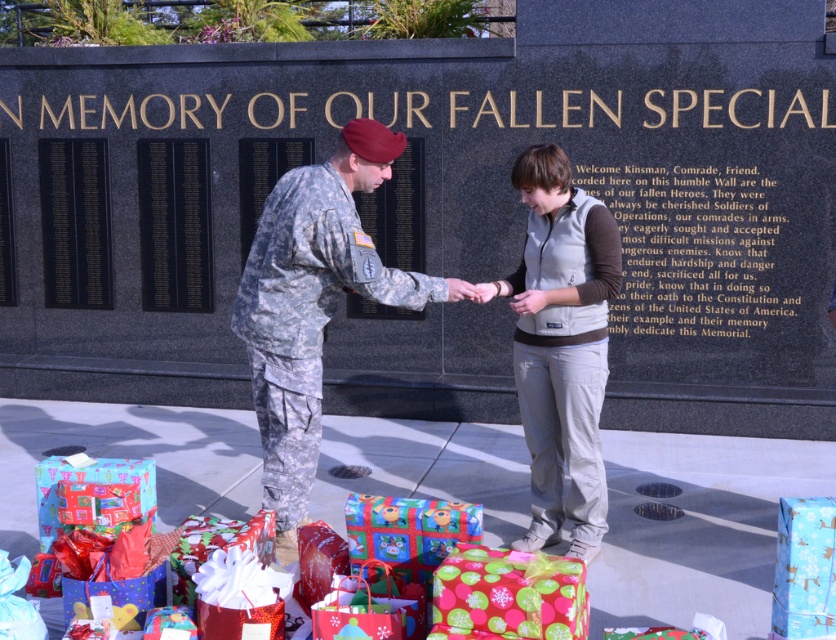
You are a photographer trying to capture a photo of the memorial wall. You need to ensure both the camouflage fabric uniform at center and the blue shiny wrapping paper at lower right are visible in the frame. Given their sizes, which object should you focus on to ensure both fit in the photo?

The camouflage fabric uniform at center is wider than the blue shiny wrapping paper at lower right. To ensure both fit in the photo, focus on the camouflage fabric uniform at center since it is larger and requires more space.

You are a photographer trying to capture a closeup of the camouflage fabric uniform at center and the green polka dot paper at lower center. Which object should you focus on first if you want to ensure both are in focus without moving the camera?

The camouflage fabric uniform at center is located above the green polka dot paper at lower center. Since they are at different heights, focusing on the camouflage fabric uniform at center first would allow the green polka dot paper at lower center to be in focus as well due to depth of field, provided they are within the acceptable focus range.

You are standing in front of the memorial wall and want to place a wreath at the closest point between point [584,442] and point [437,616]. Which point should you choose?

Point [437,616] is closer to you than point [584,442], so you should place the wreath at point [437,616].